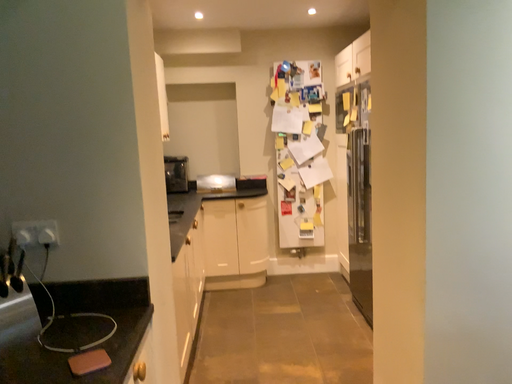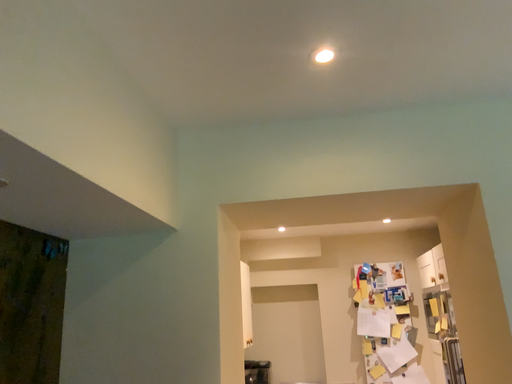
Question: How did the camera likely rotate when shooting the video?

Choices:
 (A) rotated downward
 (B) rotated upward

Answer: (B)